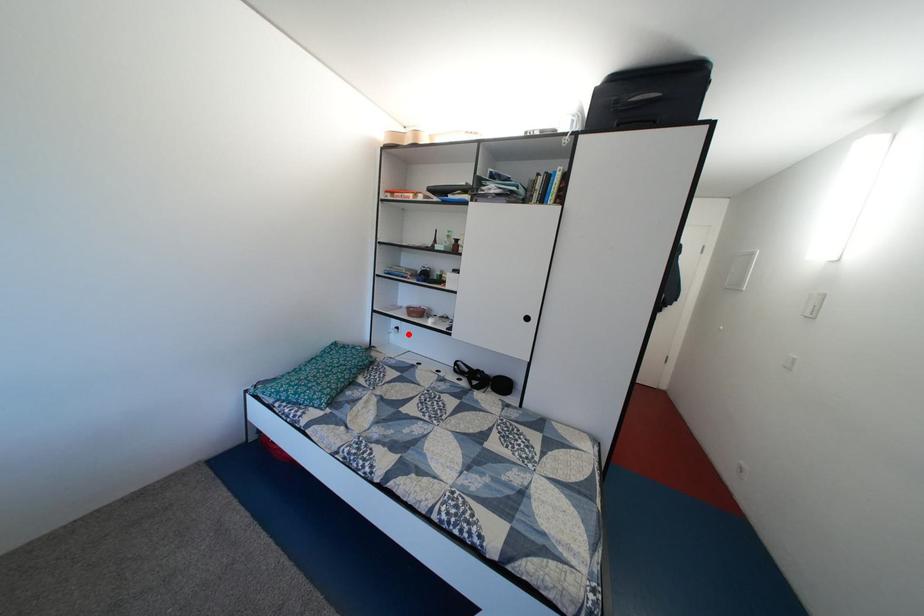
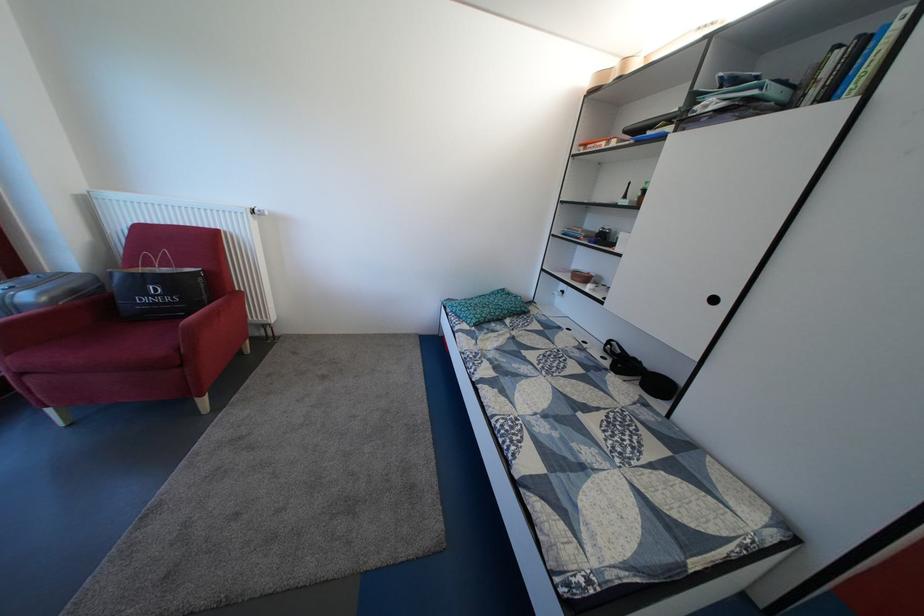
Question: I am providing you with two images of the same scene from different viewpoints. In image1, a red point is highlighted. Considering the same 3D point in image2, which of the following is correct?

Choices:
 (A) It is closer
 (B) It is farther

Answer: (A)